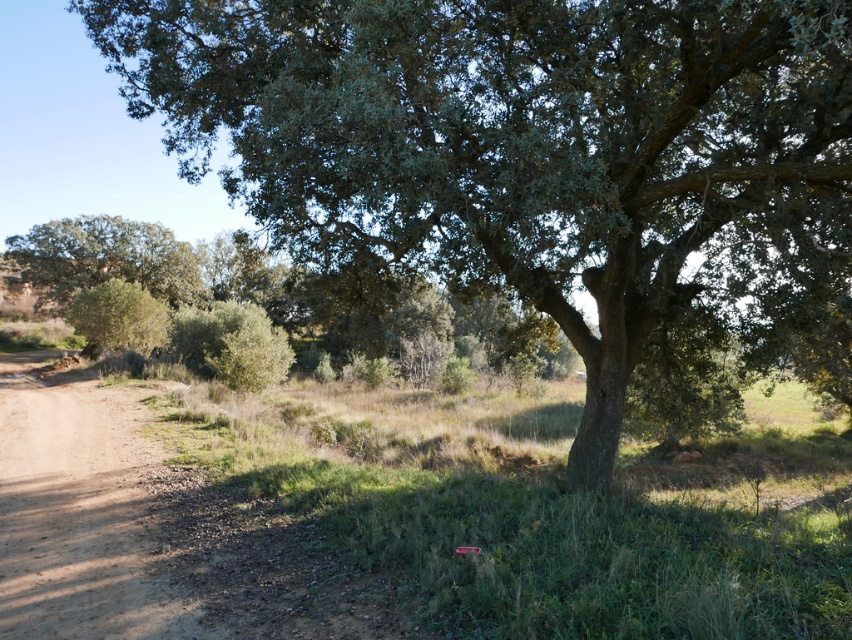
Question: Does green leafy tree at center have a lesser width compared to brown dirt track at lower left?

Choices:
 (A) no
 (B) yes

Answer: (A)

Question: Can you confirm if green leafy tree at center is positioned to the left of brown dirt track at lower left?

Choices:
 (A) yes
 (B) no

Answer: (B)

Question: Which object appears farthest from the camera in this image?

Choices:
 (A) brown dirt track at lower left
 (B) green leafy tree at center

Answer: (A)

Question: Considering the relative positions of green leafy tree at center and brown dirt track at lower left in the image provided, where is green leafy tree at center located with respect to brown dirt track at lower left?

Choices:
 (A) left
 (B) right

Answer: (B)